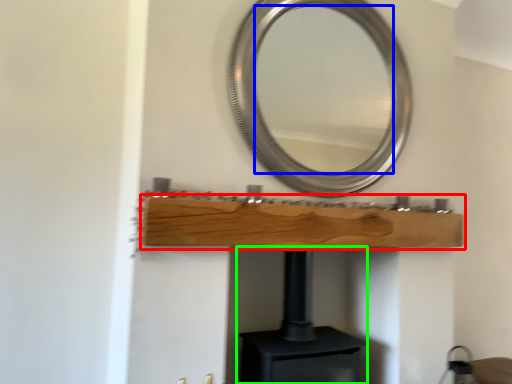
Question: Considering the real-world distances, which object is farthest from shelf (highlighted by a red box)? mirror (highlighted by a blue box) or fireplace (highlighted by a green box)?

Choices:
 (A) mirror
 (B) fireplace

Answer: (A)